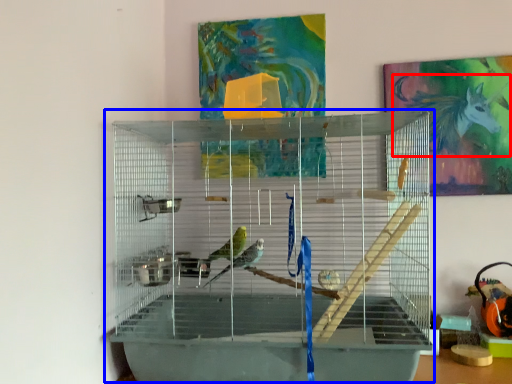
Question: Which of the following is the farthest to the observer, animal (highlighted by a red box) or bird cage (highlighted by a blue box)?

Choices:
 (A) animal
 (B) bird cage

Answer: (A)